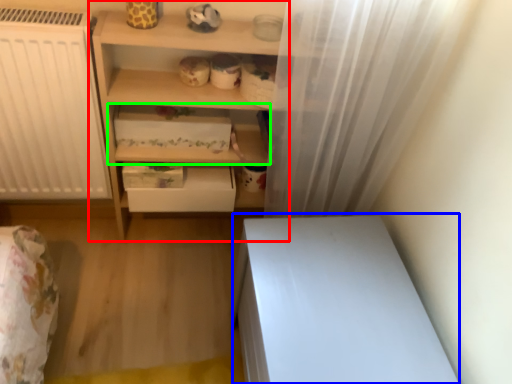
Question: Which object is positioned farthest from shelf (highlighted by a red box)? Select from vanity (highlighted by a blue box) and shelf (highlighted by a green box).

Choices:
 (A) vanity
 (B) shelf

Answer: (A)